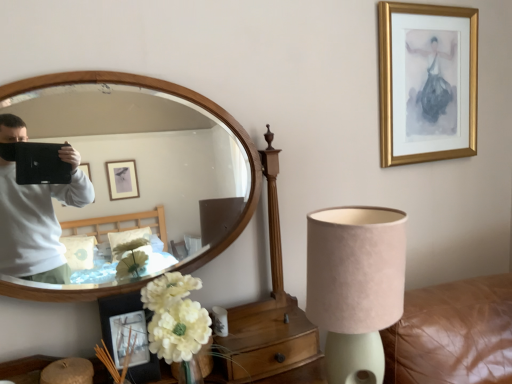
Question: Should I look upward or downward to see gold framed picture at upper right, which is counted as the 2th picture frame, starting from the front?

Choices:
 (A) up
 (B) down

Answer: (A)

Question: Would you consider matte black picture frame at lower left, the second picture frame viewed from the top, to be distant from suede lampshade at lower right?

Choices:
 (A) no
 (B) yes

Answer: (A)

Question: Is matte black picture frame at lower left, positioned as the 1th picture frame in left-to-right order, facing away from suede lampshade at lower right?

Choices:
 (A) no
 (B) yes

Answer: (A)

Question: Is the position of matte black picture frame at lower left, marked as the 1th picture frame in a bottom-to-top arrangement, less distant than that of suede lampshade at lower right?

Choices:
 (A) no
 (B) yes

Answer: (A)

Question: Can you confirm if matte black picture frame at lower left, which ranks as the second picture frame in back-to-front order, is bigger than suede lampshade at lower right?

Choices:
 (A) yes
 (B) no

Answer: (B)

Question: From a real-world perspective, is matte black picture frame at lower left, which ranks as the second picture frame in back-to-front order, below suede lampshade at lower right?

Choices:
 (A) no
 (B) yes

Answer: (B)

Question: Considering the relative sizes of matte black picture frame at lower left, positioned as the 1th picture frame in left-to-right order, and suede lampshade at lower right in the image provided, is matte black picture frame at lower left, positioned as the 1th picture frame in left-to-right order, thinner than suede lampshade at lower right?

Choices:
 (A) no
 (B) yes

Answer: (B)

Question: From the image's perspective, does matte black picture frame at lower left, marked as the 1th picture frame in a bottom-to-top arrangement, appear higher than wooden drawer at lower center?

Choices:
 (A) yes
 (B) no

Answer: (A)

Question: From a real-world perspective, is matte black picture frame at lower left, positioned as the 1th picture frame in front-to-back order, located beneath wooden drawer at lower center?

Choices:
 (A) yes
 (B) no

Answer: (B)

Question: Is matte black picture frame at lower left, marked as the 1th picture frame in a bottom-to-top arrangement, positioned behind wooden drawer at lower center?

Choices:
 (A) no
 (B) yes

Answer: (A)

Question: Considering the relative sizes of matte black picture frame at lower left, which ranks as the second picture frame in back-to-front order, and wooden drawer at lower center in the image provided, is matte black picture frame at lower left, which ranks as the second picture frame in back-to-front order, taller than wooden drawer at lower center?

Choices:
 (A) yes
 (B) no

Answer: (A)

Question: Is matte black picture frame at lower left, which ranks as the second picture frame in back-to-front order, located outside wooden drawer at lower center?

Choices:
 (A) no
 (B) yes

Answer: (B)

Question: Can you confirm if matte black picture frame at lower left, positioned as the 1th picture frame in left-to-right order, is positioned to the left of wooden drawer at lower center?

Choices:
 (A) yes
 (B) no

Answer: (A)

Question: Is gold framed picture at upper right, the 2th picture frame when ordered from bottom to top, at the back of white fabric flower at lower left?

Choices:
 (A) yes
 (B) no

Answer: (B)